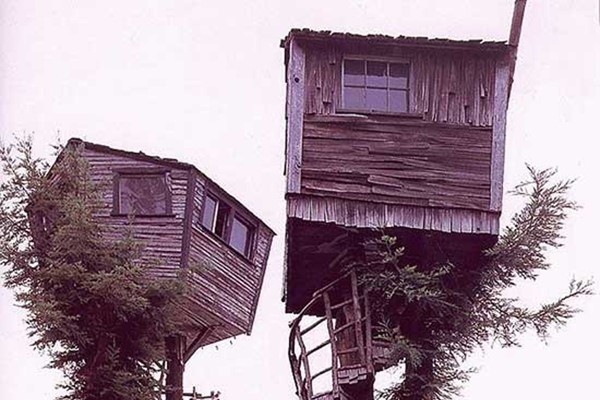
You are a GUI agent. You are given a task and a screenshot of the screen. Output one action in this format:
    pyautogui.click(x=<x>, y=<y>)
    Task: Click on the window with boards over
    
    Given the screenshot: What is the action you would take?
    pyautogui.click(x=365, y=90)